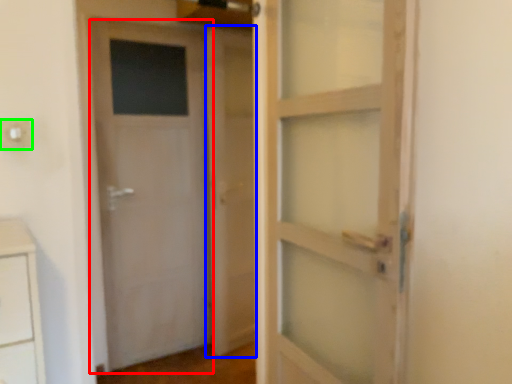
Question: Considering the real-world distances, which object is farthest from door (highlighted by a red box)? barn door (highlighted by a blue box) or electric outlet (highlighted by a green box)?

Choices:
 (A) barn door
 (B) electric outlet

Answer: (B)